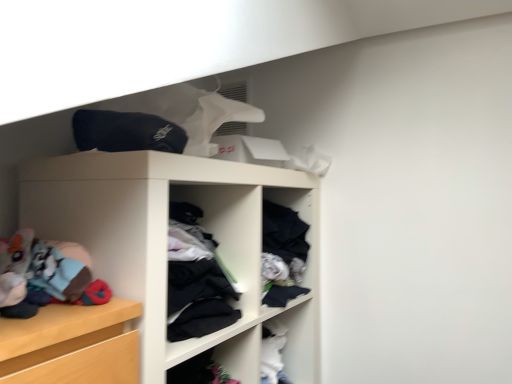
Question: In the image, is black matte cap at upper center on the left side or the right side of white matte shelf at center?

Choices:
 (A) left
 (B) right

Answer: (A)

Question: In the image, is black matte cap at upper center positioned in front of or behind white matte shelf at center?

Choices:
 (A) behind
 (B) front

Answer: (A)

Question: Considering the positions of black matte cap at upper center and white matte shelf at center in the image, is black matte cap at upper center wider or thinner than white matte shelf at center?

Choices:
 (A) wide
 (B) thin

Answer: (B)

Question: From a real-world perspective, is white matte shelf at center physically located above or below black matte cap at upper center?

Choices:
 (A) above
 (B) below

Answer: (B)

Question: From the image's perspective, is white matte shelf at center above or below black matte cap at upper center?

Choices:
 (A) below
 (B) above

Answer: (A)

Question: Considering the relative positions of white matte shelf at center and black matte cap at upper center in the image provided, is white matte shelf at center to the left or to the right of black matte cap at upper center?

Choices:
 (A) right
 (B) left

Answer: (A)

Question: In the image, is white matte shelf at center positioned in front of or behind black matte cap at upper center?

Choices:
 (A) front
 (B) behind

Answer: (A)